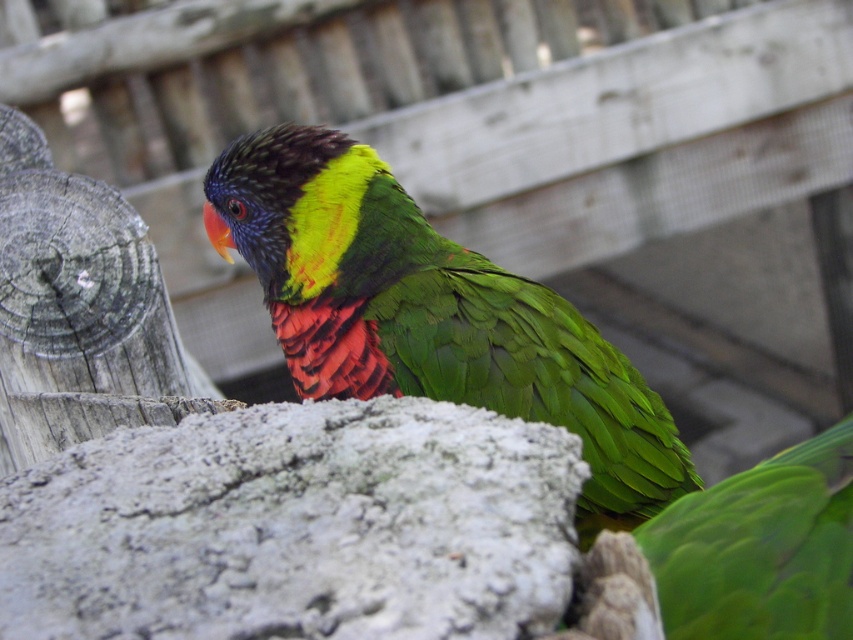
Consider the image. You are an ornithologist observing two parrots in the image. The shiny green parrot at center and the green matte parrot at center. Which parrot has a greater width?

The shiny green parrot at center has a greater width than the green matte parrot at center according to the description.